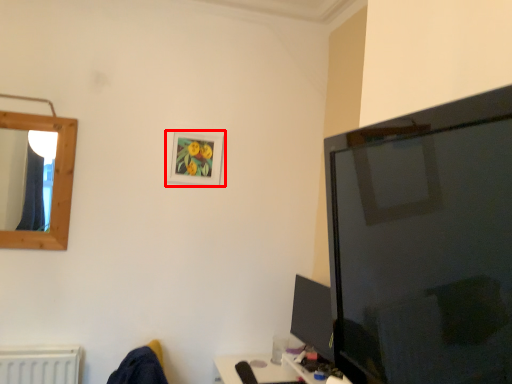
Question: From the image's perspective, where is picture frame (annotated by the red box) located relative to tv show?

Choices:
 (A) above
 (B) below

Answer: (A)